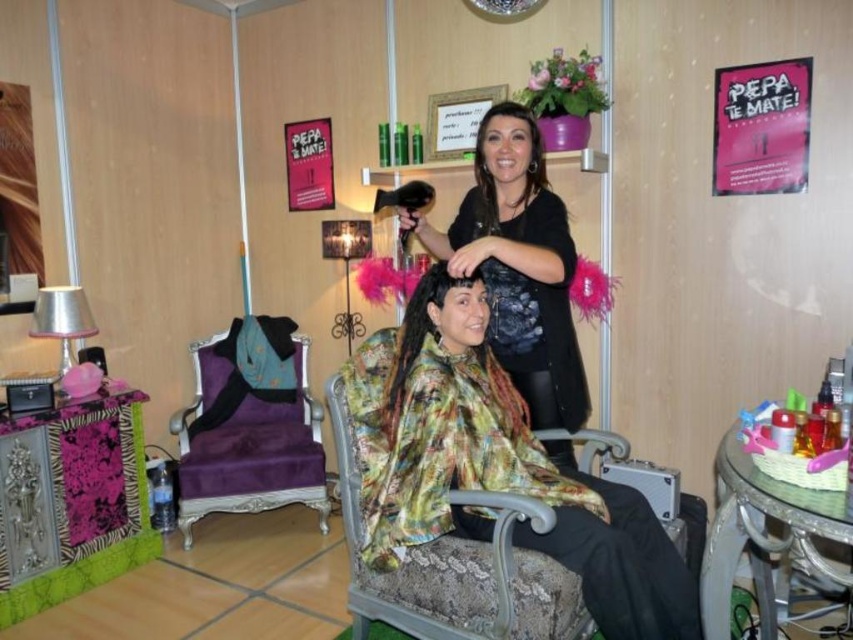
Question: Which of the following is the closest to the observer?

Choices:
 (A) (506, 188)
 (B) (468, 579)
 (C) (241, 403)

Answer: (B)

Question: From the image, what is the correct spatial relationship of floral silk robe at center in relation to silk floral-patterned chair at center?

Choices:
 (A) below
 (B) above

Answer: (B)

Question: Among these points, which one is farthest from the camera?

Choices:
 (A) (578, 579)
 (B) (259, 483)

Answer: (B)

Question: Is silk floral-patterned chair at center bigger than purple velvet chair at left?

Choices:
 (A) yes
 (B) no

Answer: (B)

Question: Which object appears farthest from the camera in this image?

Choices:
 (A) purple velvet chair at left
 (B) silk floral-patterned chair at center
 (C) floral silk robe at center

Answer: (A)

Question: Is silk floral-patterned chair at center further to the viewer compared to purple velvet chair at left?

Choices:
 (A) no
 (B) yes

Answer: (A)